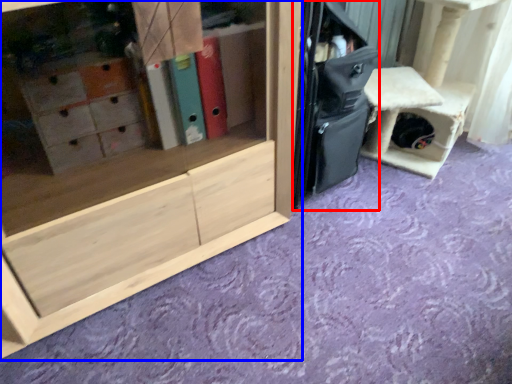
Question: Which point is closer to the camera, luggage (highlighted by a red box) or cabinetry (highlighted by a blue box)?

Choices:
 (A) luggage
 (B) cabinetry

Answer: (B)